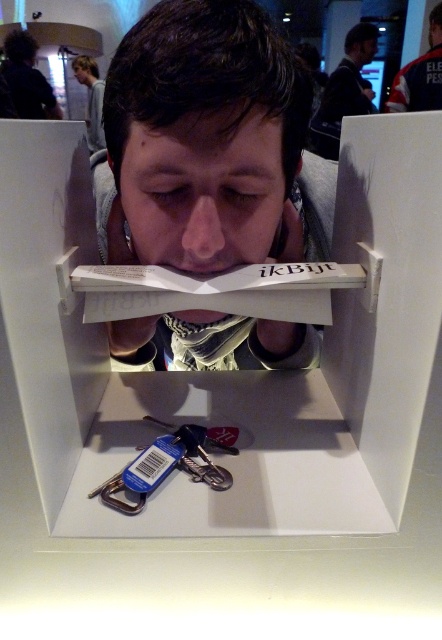
You are a security guard checking the exhibit. You see the metallic key at lower center and the white fabric shirt at upper center. Which object is located to the left of the other?

The metallic key at lower center is positioned on the left side of white fabric shirt at upper center.

You are standing in front of the interactive exhibit with the white box. There are two points marked inside the box at coordinates point (x=391, y=460) and point (x=33, y=88). Which point is closer to you?

Point (x=391, y=460) is closer to the viewer than point (x=33, y=88).